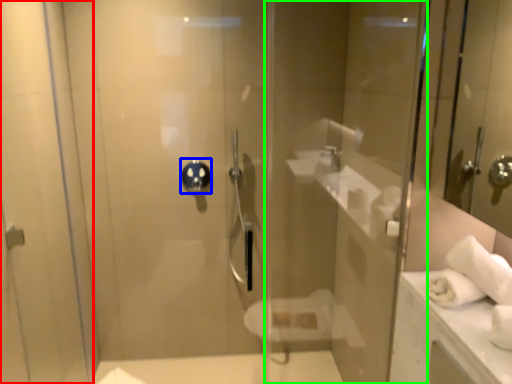
Question: Which is farther away from screen door (highlighted by a red box)? shower (highlighted by a blue box) or glass door (highlighted by a green box)?

Choices:
 (A) shower
 (B) glass door

Answer: (B)